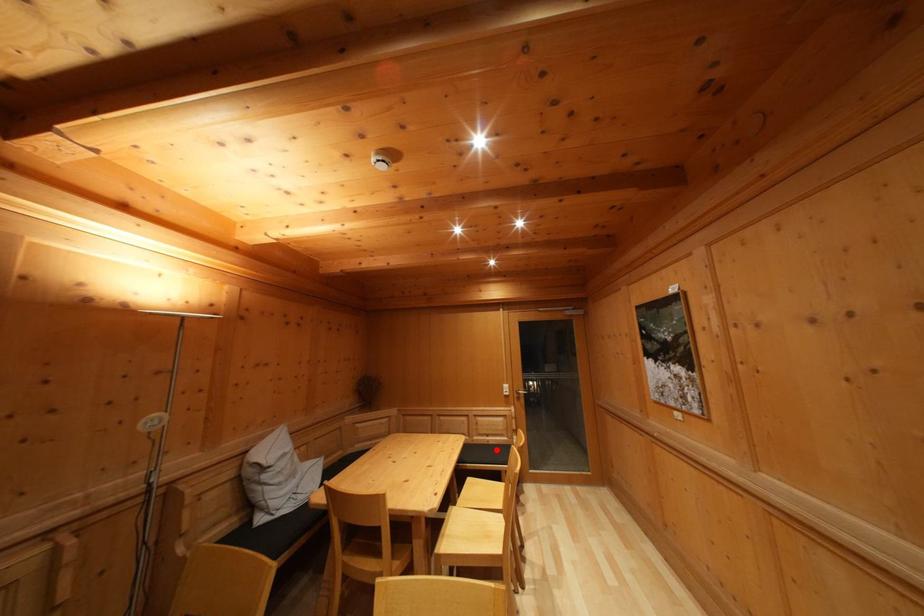
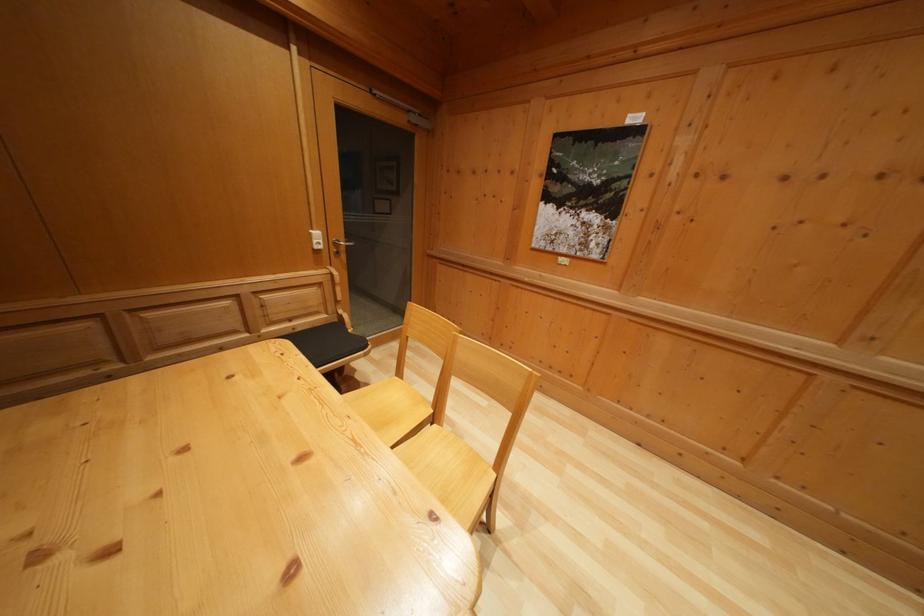
Where in the second image is the point corresponding to the highlighted location from the first image?

(305, 336)